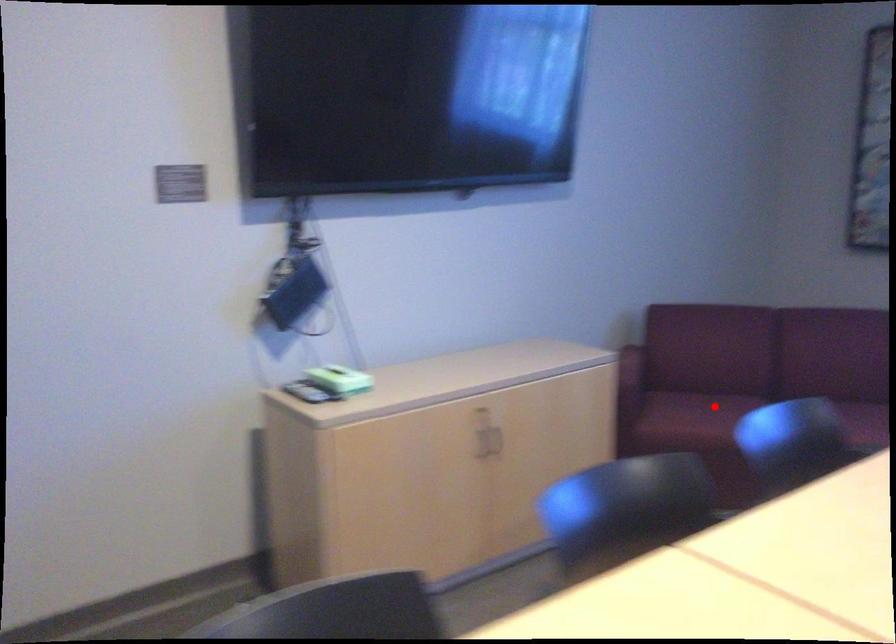
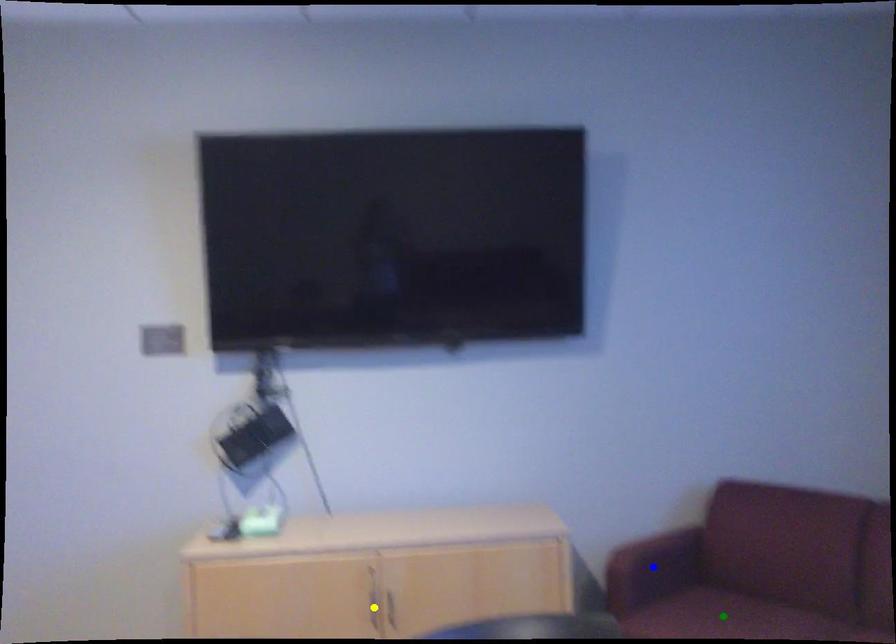
Question: I am providing you with two images of the same scene from different viewpoints. A red point is marked on the first image. You are given multiple points on the second image. In image 2, which mark is for the same physical point as the one in image 1?

Choices:
 (A) yellow point
 (B) blue point
 (C) green point

Answer: (C)